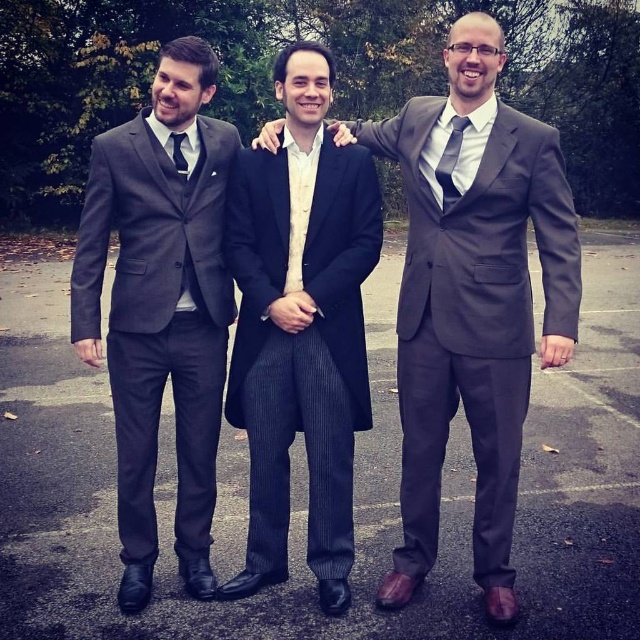
Does dark gray suit at center appear on the left side of dark gray silk tie at center?

Incorrect, dark gray suit at center is not on the left side of dark gray silk tie at center.

Can you confirm if dark gray suit at center is positioned below dark gray silk tie at center?

Yes, dark gray suit at center is below dark gray silk tie at center.

Does point (451, 310) come closer to viewer compared to point (442, 164)?

No, (451, 310) is behind (442, 164).

Locate an element on the screen. This screenshot has height=640, width=640. dark gray suit at center is located at coordinates (472, 301).

Is matte black suit at left to the left of dark gray silk tie at center from the viewer's perspective?

Yes, matte black suit at left is to the left of dark gray silk tie at center.

Is point (188, 435) positioned in front of point (458, 198)?

No, it is behind (458, 198).

Locate an element on the screen. Image resolution: width=640 pixels, height=640 pixels. matte black suit at left is located at coordinates (161, 307).

Where is `matte black suit at left`? This screenshot has width=640, height=640. matte black suit at left is located at coordinates (161, 307).

The image size is (640, 640). Describe the element at coordinates (451, 161) in the screenshot. I see `dark gray silk tie at center` at that location.

Looking at this image, can you confirm if dark gray silk tie at center is shorter than matte black tie at center?

Incorrect, dark gray silk tie at center's height does not fall short of matte black tie at center's.

The height and width of the screenshot is (640, 640). I want to click on dark gray silk tie at center, so click(451, 161).

At what (x,y) coordinates should I click in order to perform the action: click on dark gray silk tie at center. Please return your answer as a coordinate pair (x, y). The height and width of the screenshot is (640, 640). Looking at the image, I should click on (451, 161).